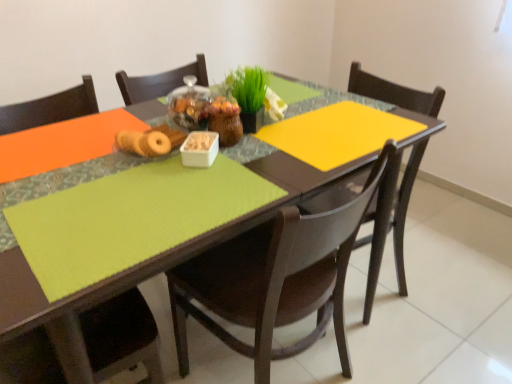
Question: From the image's perspective, is green matte grass at center above or below white plastic container at center?

Choices:
 (A) above
 (B) below

Answer: (A)

Question: From a real-world perspective, is green matte grass at center positioned above or below white plastic container at center?

Choices:
 (A) above
 (B) below

Answer: (A)

Question: Estimate the real-world distances between objects in this image. Which object is closer to the matte brown chair at center, the second chair when ordered from right to left?

Choices:
 (A) lime green fabric table at center
 (B) matte brown donuts at center
 (C) white plastic container at center
 (D) green matte grass at center
 (E) matte green placemat at lower left, acting as the first chair starting from the left

Answer: (A)

Question: Which of these objects is positioned farthest from the green matte grass at center?

Choices:
 (A) matte wood chair at upper right, placed as the 1th chair when sorted from right to left
 (B) matte brown chair at center, acting as the 2th chair starting from the left
 (C) white plastic container at center
 (D) lime green fabric table at center
 (E) matte brown donuts at center

Answer: (A)